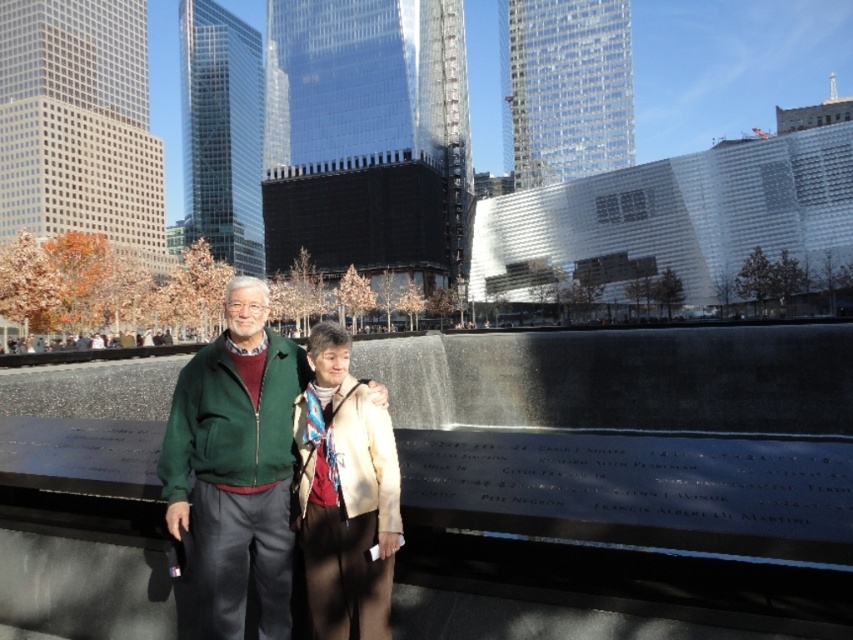
Question: Which of the following is the farthest from the observer?

Choices:
 (A) beige textured jacket at center
 (B) green fleece jacket at center

Answer: (B)

Question: Which point is farther to the camera?

Choices:
 (A) (392, 509)
 (B) (229, 470)

Answer: (B)

Question: Does green fleece jacket at center lie in front of beige textured jacket at center?

Choices:
 (A) no
 (B) yes

Answer: (A)

Question: Observing the image, what is the correct spatial positioning of green fleece jacket at center in reference to beige textured jacket at center?

Choices:
 (A) above
 (B) below

Answer: (A)

Question: Can you confirm if green fleece jacket at center is positioned below beige textured jacket at center?

Choices:
 (A) no
 (B) yes

Answer: (A)